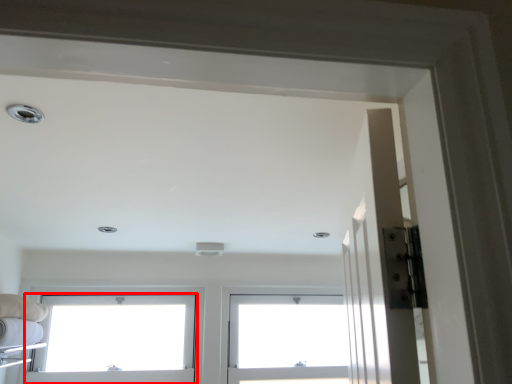
Question: Observing the image, what is the correct spatial positioning of window (annotated by the red box) in reference to window?

Choices:
 (A) left
 (B) right

Answer: (A)